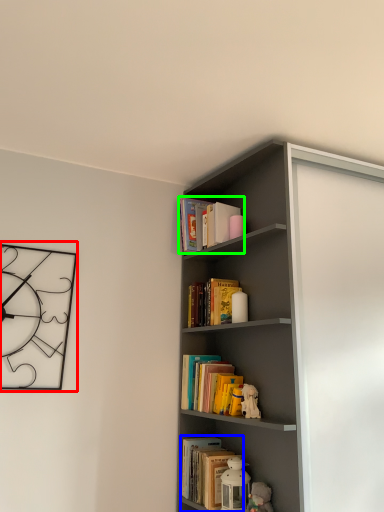
Question: Which is nearer to the clock (highlighted by a red box)? book (highlighted by a blue box) or book (highlighted by a green box).

Choices:
 (A) book
 (B) book

Answer: (B)